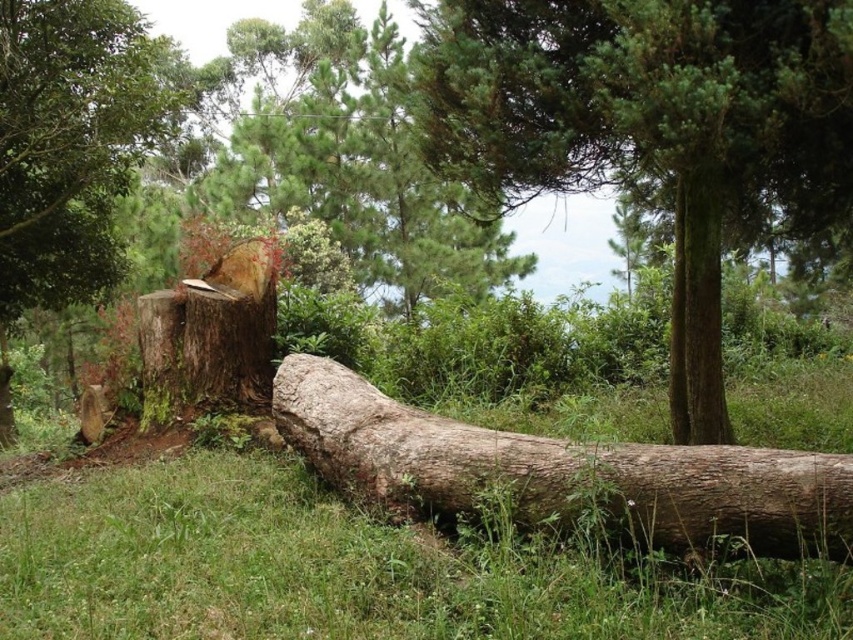
You are a hiker who wants to place a heavy backpack on the ground. You see the brown rough tree stump at left and the brown rough wood stump at center. Which stump is shorter and thus safer to place your backpack on?

The brown rough tree stump at left is shorter than the brown rough wood stump at center, so it is safer to place your backpack there.

You are standing at the center of the image and want to place a small wooden bench. The bench requires a flat area that is 1 meter wide. Is there enough space between the brown rough tree stump at left and the edge of the image on the right side to place the bench?

The brown rough tree stump at left is located at point (73, 141). Since the bench requires 1 meter of flat space and the stump is positioned at the left, there should be sufficient space between the stump and the right edge to place the bench, assuming the image dimensions allow it.

You are a gardener who needs to move a 1.5 meter long garden hose from the brown rough log at center to the brown rough wood stump at center. Can you lay the hose directly between them without bending it?

The distance between the brown rough log at center and the brown rough wood stump at center is 1.51 meters. Since the hose is 1.5 meters long, it is slightly shorter than the required distance. Therefore, the hose cannot be laid straight between them without bending.